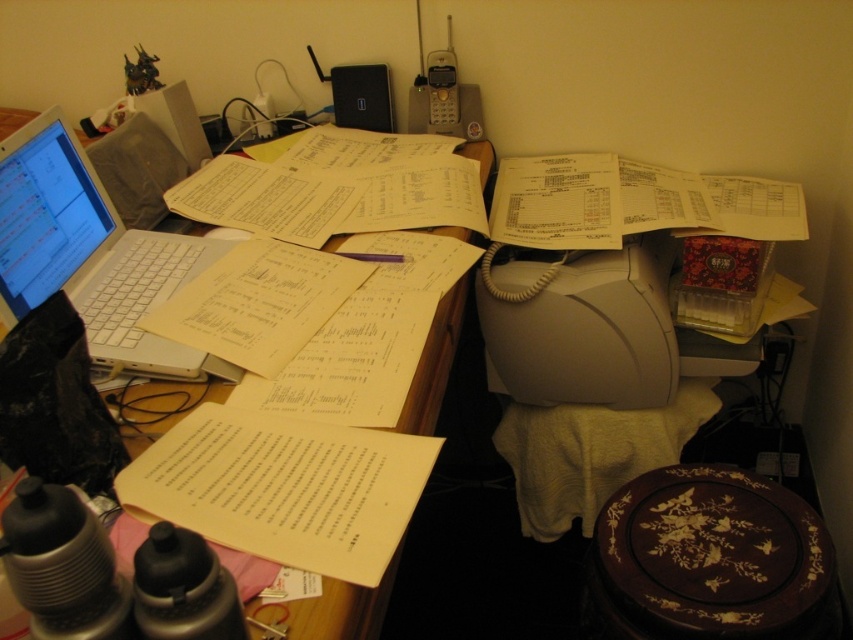
Can you confirm if yellow paper at center is positioned below white matte laptop at left?

Yes, yellow paper at center is below white matte laptop at left.

Image resolution: width=853 pixels, height=640 pixels. What are the coordinates of `yellow paper at center` in the screenshot? It's located at (283, 486).

The image size is (853, 640). I want to click on yellow paper at center, so click(283, 486).

Consider the image. Which of these two, white matte laptop at left or wooden at left, stands taller?

Standing taller between the two is wooden at left.

Is white matte laptop at left wider than wooden at left?

Incorrect, white matte laptop at left's width does not surpass wooden at left's.

The width and height of the screenshot is (853, 640). In order to click on white matte laptop at left in this screenshot , I will do `click(91, 253)`.

Can you confirm if yellow paper at center is positioned to the right of wooden at left?

Yes, yellow paper at center is to the right of wooden at left.

In the scene shown: Which is below, yellow paper at center or wooden at left?

Positioned lower is yellow paper at center.

Locate an element on the screen. yellow paper at center is located at coordinates (283, 486).